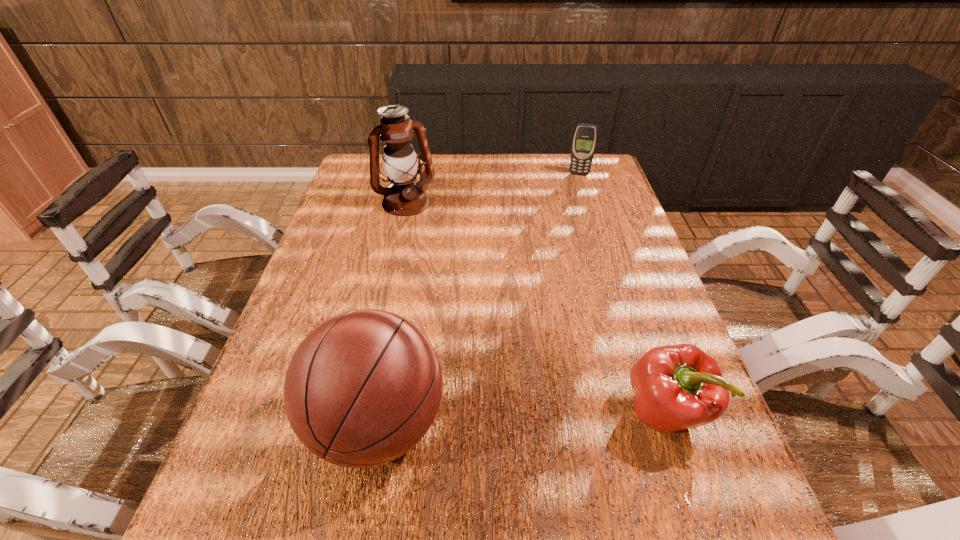
Identify the location of free point located 0.260m on the side of the tallest object, there is a wick adjustment knob. (442, 268).

I want to click on free space located 0.210m on the side of the tallest object, there is a wick adjustment knob, so click(436, 257).

I want to click on free space located on the side of the tallest object, there is a wick adjustment knob, so click(438, 261).

Locate an element on the screen. object at the far edge is located at coordinates (585, 136).

At what (x,y) coordinates should I click in order to perform the action: click on basketball present at the near edge. Please return your answer as a coordinate pair (x, y). This screenshot has height=540, width=960. Looking at the image, I should click on (363, 388).

Image resolution: width=960 pixels, height=540 pixels. I want to click on pepper that is at the near edge, so click(x=677, y=387).

This screenshot has width=960, height=540. What are the coordinates of `basketball at the left edge` in the screenshot? It's located at (363, 388).

The image size is (960, 540). Identify the location of lantern at the left edge. (405, 196).

Image resolution: width=960 pixels, height=540 pixels. Identify the location of pepper that is at the right edge. (677, 387).

Find the location of a particular element. Image resolution: width=960 pixels, height=540 pixels. cellular telephone at the right edge is located at coordinates (585, 136).